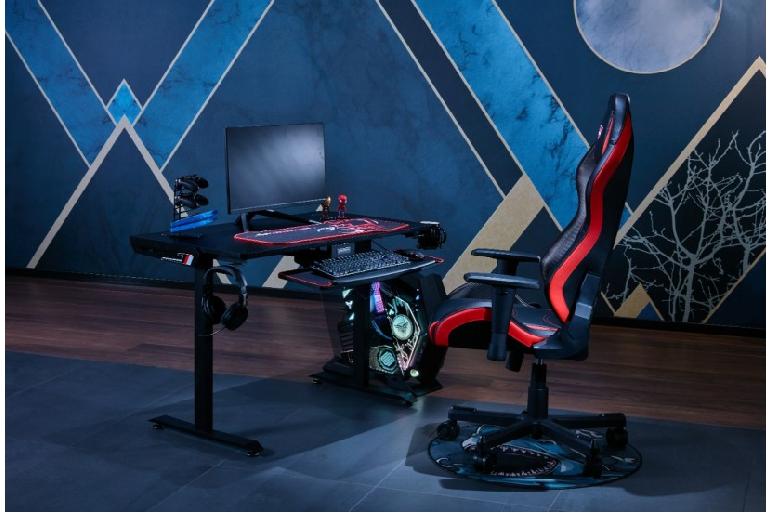
Locate an element on the screen. Image resolution: width=768 pixels, height=512 pixels. left arm rest is located at coordinates (505, 281).